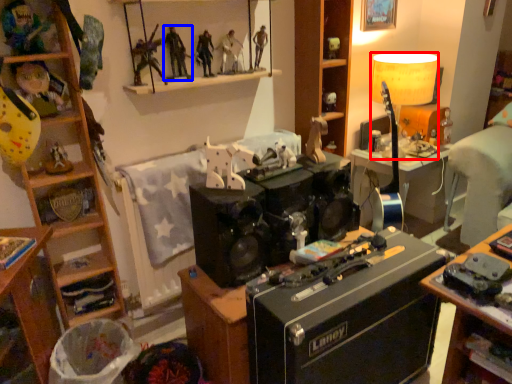
Question: Which object is further to the camera taking this photo, lamp (highlighted by a red box) or person (highlighted by a blue box)?

Choices:
 (A) lamp
 (B) person

Answer: (A)